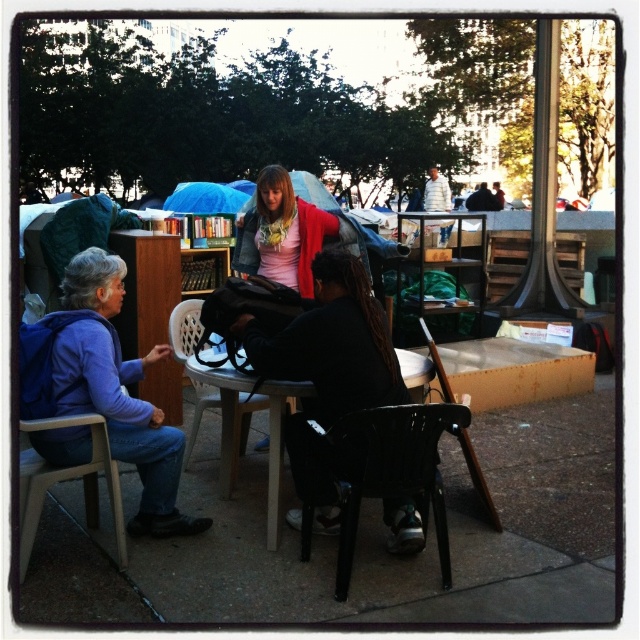
Does white plastic table at center appear under white plastic chair at center?

Yes, white plastic table at center is below white plastic chair at center.

Which is behind, point (416, 358) or point (260, 396)?

The point (260, 396) is more distant.

The image size is (640, 640). Identify the location of white plastic table at center. (225, 413).

Is point (355, 237) in front of point (170, 323)?

No, (355, 237) is behind (170, 323).

Who is more distant from viewer, (275, 259) or (195, 308)?

Positioned behind is point (275, 259).

This screenshot has height=640, width=640. What do you see at coordinates (288, 232) in the screenshot?
I see `matte pink shirt at center` at bounding box center [288, 232].

Locate an element on the screen. Image resolution: width=640 pixels, height=640 pixels. matte pink shirt at center is located at coordinates (288, 232).

Describe the element at coordinates (184, 328) in the screenshot. The height and width of the screenshot is (640, 640). I see `white plastic chair at center` at that location.

At what (x,y) coordinates should I click in order to perform the action: click on white plastic chair at center. Please return your answer as a coordinate pair (x, y). The image size is (640, 640). Looking at the image, I should click on (184, 328).